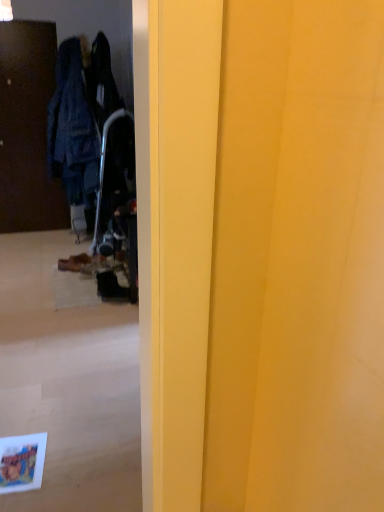
This screenshot has height=512, width=384. Find the location of `free point in front of brown suede shoe at lower left`. free point in front of brown suede shoe at lower left is located at coordinates (61, 278).